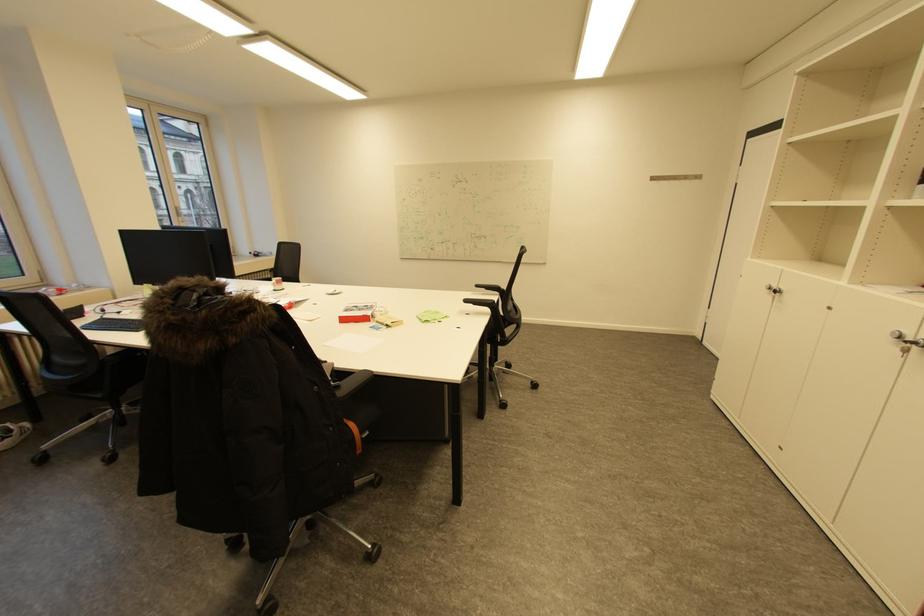
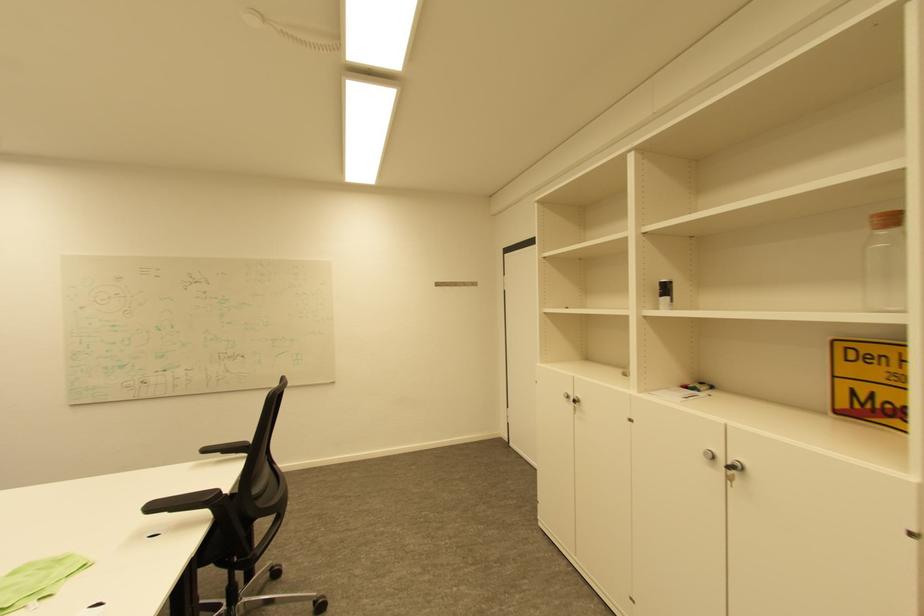
Find the pixel in the second image that matches [775,289] in the first image.

(574, 398)